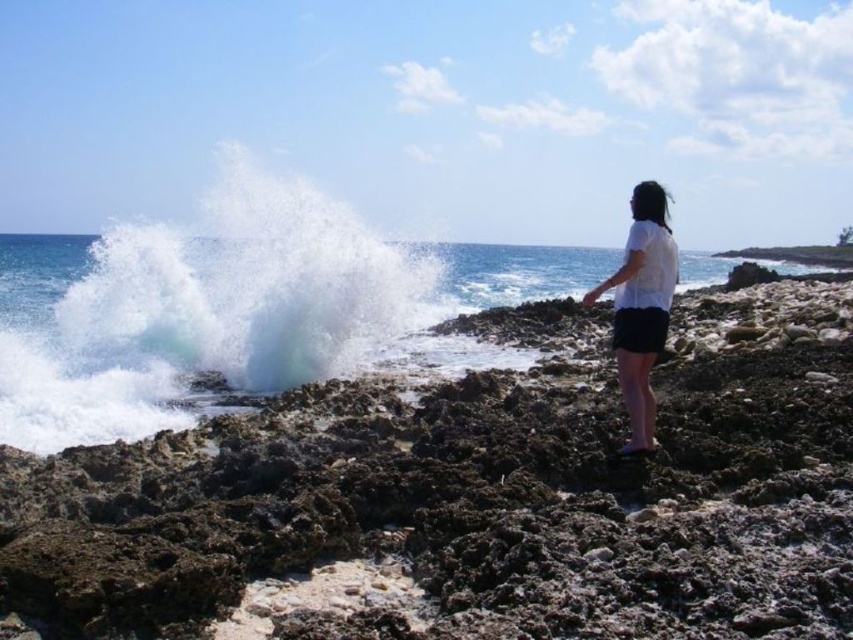
Consider the image. Can you confirm if rough textured rocks at center is thinner than clear water at wave right?

Correct, rough textured rocks at center's width is less than clear water at wave right's.

From the picture: Which is more to the right, rough textured rocks at center or clear water at wave right?

From the viewer's perspective, rough textured rocks at center appears more on the right side.

This screenshot has width=853, height=640. What do you see at coordinates (480, 492) in the screenshot?
I see `rough textured rocks at center` at bounding box center [480, 492].

The width and height of the screenshot is (853, 640). I want to click on rough textured rocks at center, so [480, 492].

Measure the distance between rough textured rocks at center and camera.

rough textured rocks at center and camera are 5.01 meters apart.

Can you confirm if rough textured rocks at center is positioned to the left of white matte shirt at right?

Yes, rough textured rocks at center is to the left of white matte shirt at right.

Where is `rough textured rocks at center`? The height and width of the screenshot is (640, 853). rough textured rocks at center is located at coordinates (480, 492).

Where is `rough textured rocks at center`? This screenshot has width=853, height=640. rough textured rocks at center is located at coordinates (480, 492).

Consider the image. Does white frothy wave at center have a greater width compared to white matte shirt at right?

Indeed, white frothy wave at center has a greater width compared to white matte shirt at right.

Which is behind, point (354, 300) or point (624, 320)?

The point (354, 300) is behind.

Between point (318, 321) and point (624, 397), which one is positioned in front?

Point (624, 397) is in front.

This screenshot has width=853, height=640. In order to click on white frothy wave at center in this screenshot , I will do `click(199, 310)`.